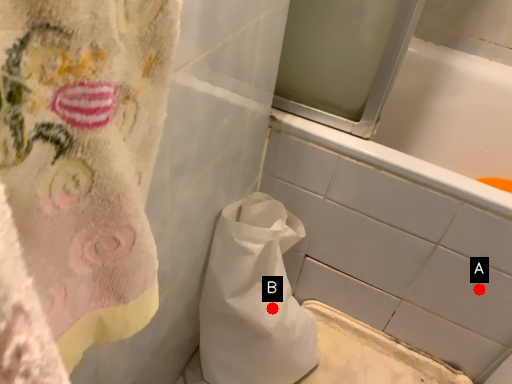
Question: Two points are circled on the image, labeled by A and B beside each circle. Which point is further to the camera?

Choices:
 (A) A is further
 (B) B is further

Answer: (B)